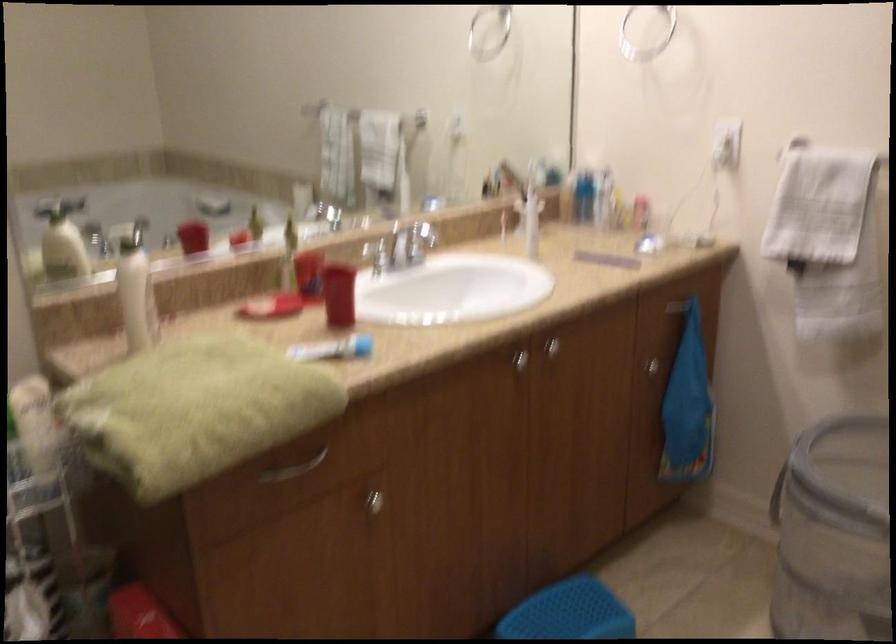
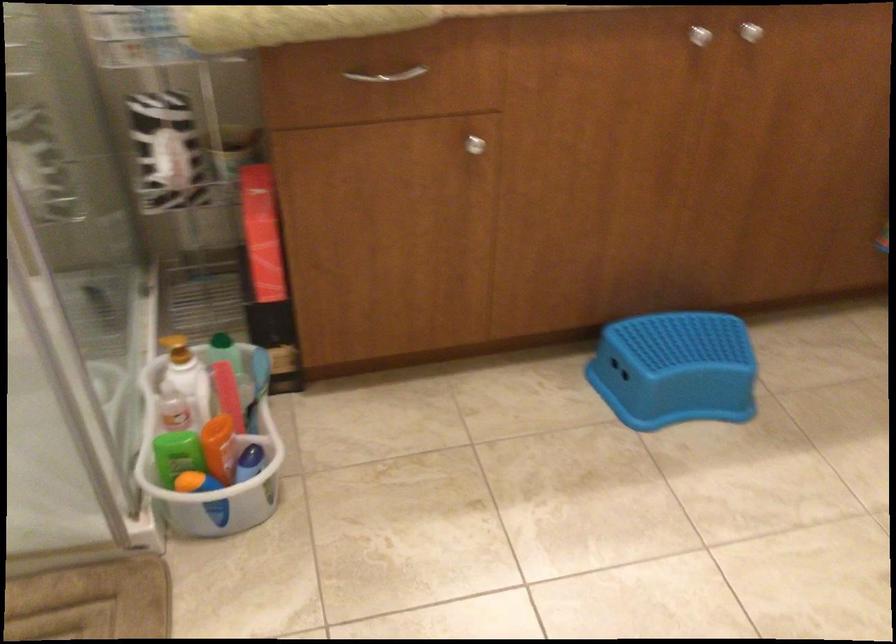
Where in the second image is the point corresponding to point (545, 343) from the first image?

(751, 32)